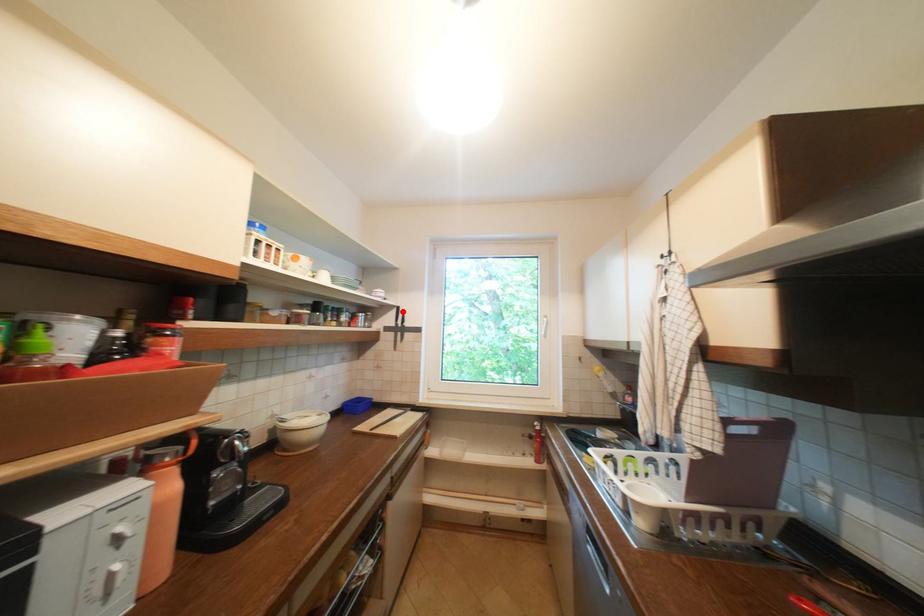
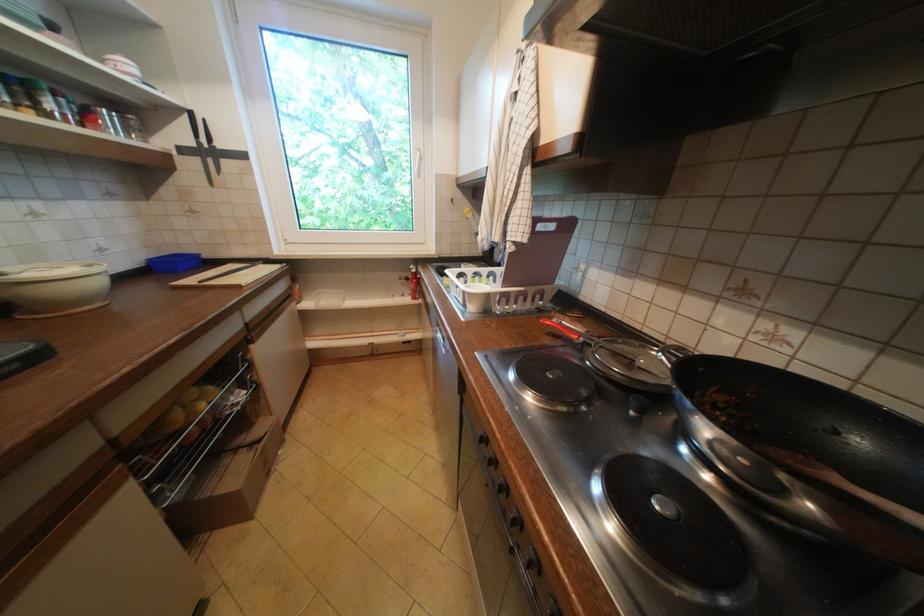
Find the pixel in the second image that matches the highlighted location in the first image.

(195, 119)